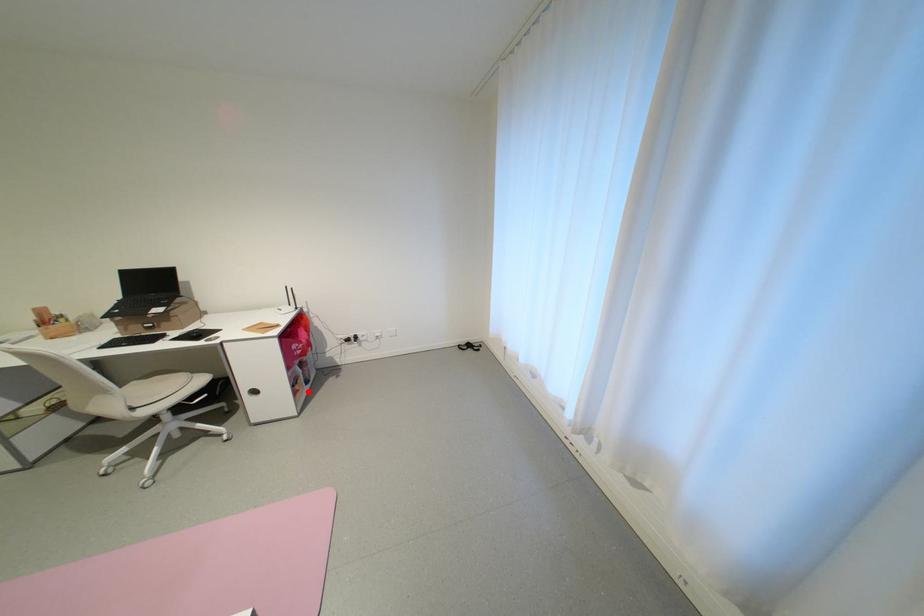
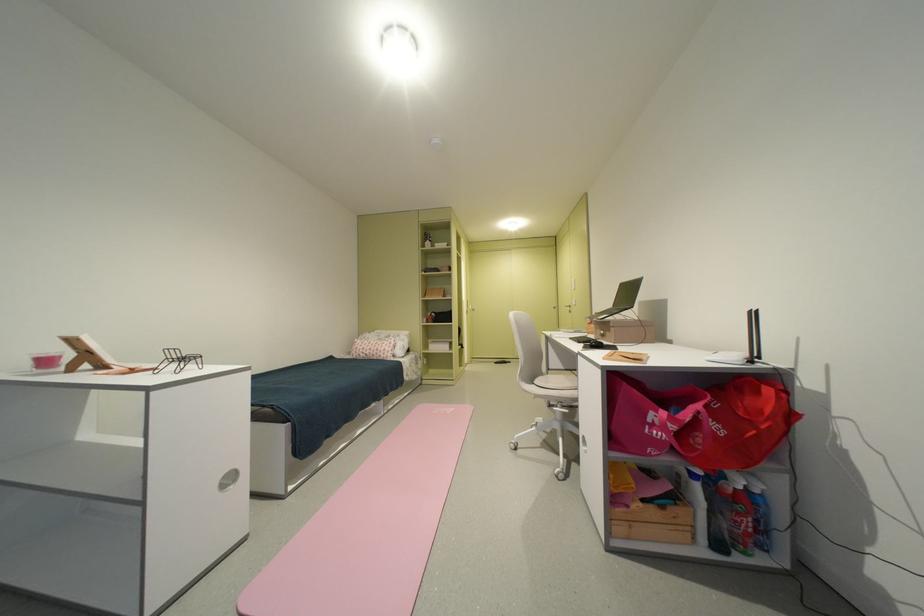
Question: A red point is marked in image1. In image2, is the corresponding 3D point closer to the camera or farther? Reply with the corresponding letter.

Choices:
 (A) The corresponding 3D point is closer.
 (B) The corresponding 3D point is farther.

Answer: (B)